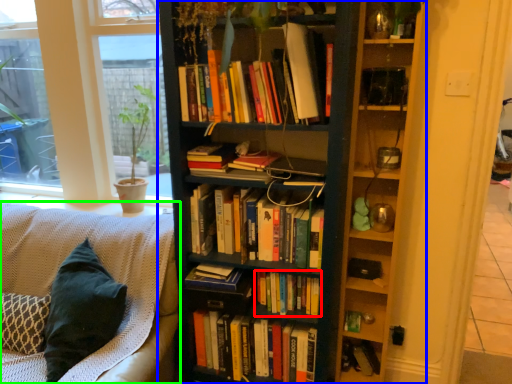
Question: Which object is positioned farthest from book (highlighted by a red box)? Select from bookcase (highlighted by a blue box) and studio couch (highlighted by a green box).

Choices:
 (A) bookcase
 (B) studio couch

Answer: (B)